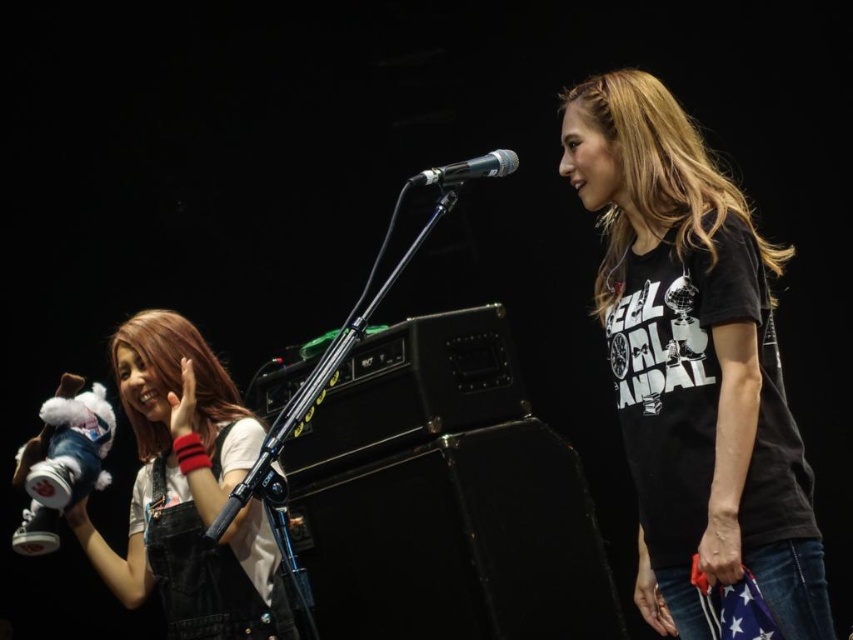
This screenshot has width=853, height=640. What do you see at coordinates (189, 492) in the screenshot?
I see `white plush toy at left` at bounding box center [189, 492].

Can you confirm if white plush toy at left is thinner than metallic silver microphone at center?

No.

This screenshot has height=640, width=853. What do you see at coordinates (189, 492) in the screenshot?
I see `white plush toy at left` at bounding box center [189, 492].

Where is `white plush toy at left`? white plush toy at left is located at coordinates (189, 492).

Which is behind, point (740, 214) or point (189, 451)?

The point (189, 451) is more distant.

Measure the distance from black cotton t-shirt at center to white plush toy at left.

A distance of 1.19 meters exists between black cotton t-shirt at center and white plush toy at left.

The height and width of the screenshot is (640, 853). In order to click on black cotton t-shirt at center in this screenshot , I will do `click(693, 362)`.

This screenshot has height=640, width=853. Find the location of `black cotton t-shirt at center`. black cotton t-shirt at center is located at coordinates (693, 362).

Between point (750, 522) and point (492, 152), which one is positioned behind?

The point (492, 152) is more distant.

Which of these two, black cotton t-shirt at center or metallic silver microphone at center, stands shorter?

Standing shorter between the two is metallic silver microphone at center.

The image size is (853, 640). What do you see at coordinates (693, 362) in the screenshot?
I see `black cotton t-shirt at center` at bounding box center [693, 362].

This screenshot has height=640, width=853. Find the location of `black cotton t-shirt at center`. black cotton t-shirt at center is located at coordinates tap(693, 362).